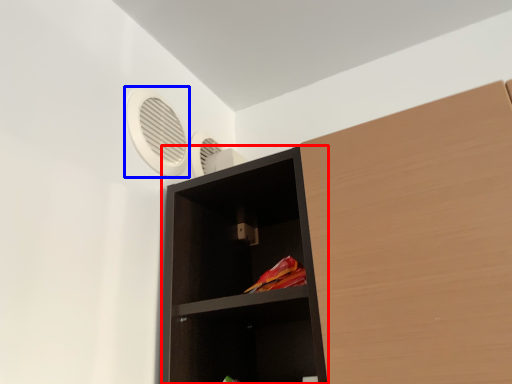
Question: Which of the following is the closest to the observer, shelf (highlighted by a red box) or fan (highlighted by a blue box)?

Choices:
 (A) shelf
 (B) fan

Answer: (A)